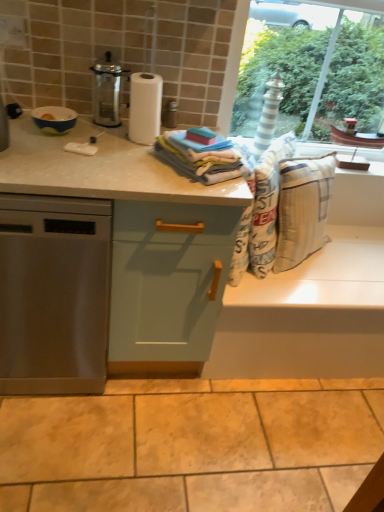
Question: Is metallic glass carafe at upper left taller or shorter than soft cotton towels at center?

Choices:
 (A) short
 (B) tall

Answer: (B)

Question: Is metallic glass carafe at upper left bigger or smaller than soft cotton towels at center?

Choices:
 (A) small
 (B) big

Answer: (B)

Question: Considering the real-world distances, which object is farthest from the matte ceramic bowl at upper left?

Choices:
 (A) stainless steel dishwasher at left
 (B) metallic glass carafe at upper left
 (C) beige marble granite at lower center
 (D) soft cotton towels at center
 (E) light green wood cabinet at center

Answer: (C)

Question: Which object is the closest to the light green wood cabinet at center?

Choices:
 (A) metallic glass carafe at upper left
 (B) soft cotton towels at center
 (C) matte ceramic bowl at upper left
 (D) stainless steel dishwasher at left
 (E) beige marble granite at lower center

Answer: (D)